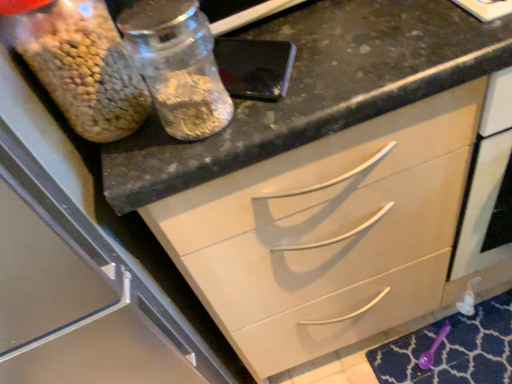
Question: From the image's perspective, is transparent glass jar at upper left located above or below translucent glass jar at upper left?

Choices:
 (A) above
 (B) below

Answer: (B)

Question: Based on their sizes in the image, would you say transparent glass jar at upper left is bigger or smaller than translucent glass jar at upper left?

Choices:
 (A) big
 (B) small

Answer: (B)

Question: Considering the real-world distances, which object is farthest from the translucent glass jar at upper left?

Choices:
 (A) transparent glass jar at upper left
 (B) black granite countertop at upper center
 (C) purple plastic spoon at lower right

Answer: (C)

Question: Estimate the real-world distances between objects in this image. Which object is farther from the purple plastic spoon at lower right?

Choices:
 (A) black granite countertop at upper center
 (B) transparent glass jar at upper left
 (C) translucent glass jar at upper left

Answer: (C)